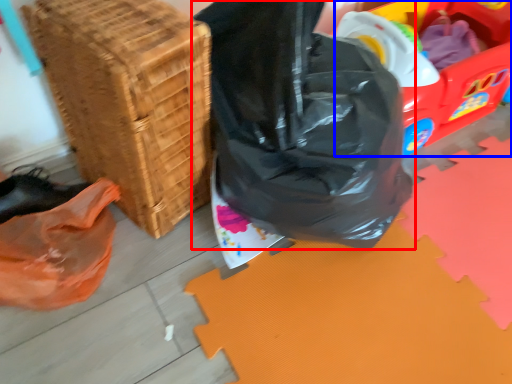
Question: Which of the following is the farthest to the observer, plastic bag (highlighted by a red box) or wagon (highlighted by a blue box)?

Choices:
 (A) plastic bag
 (B) wagon

Answer: (B)